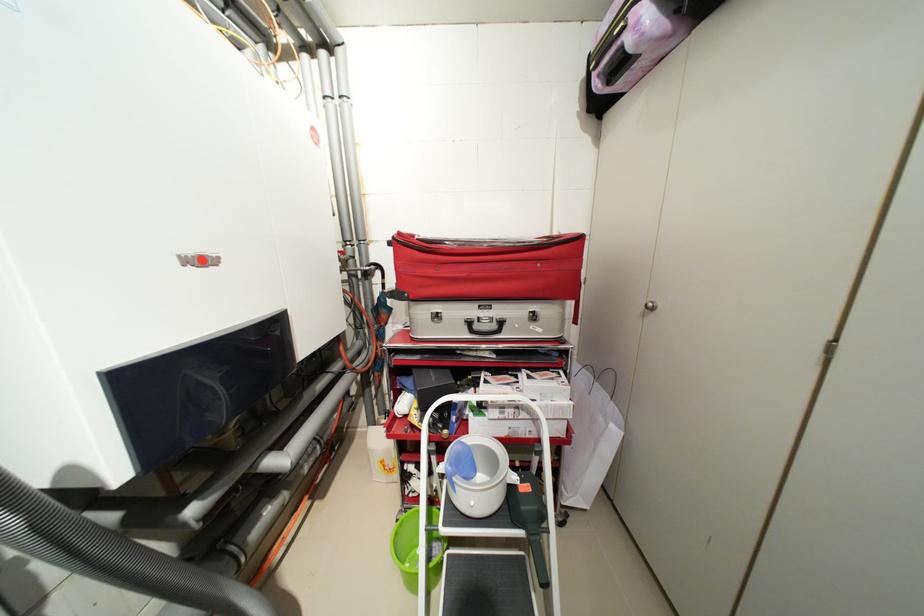
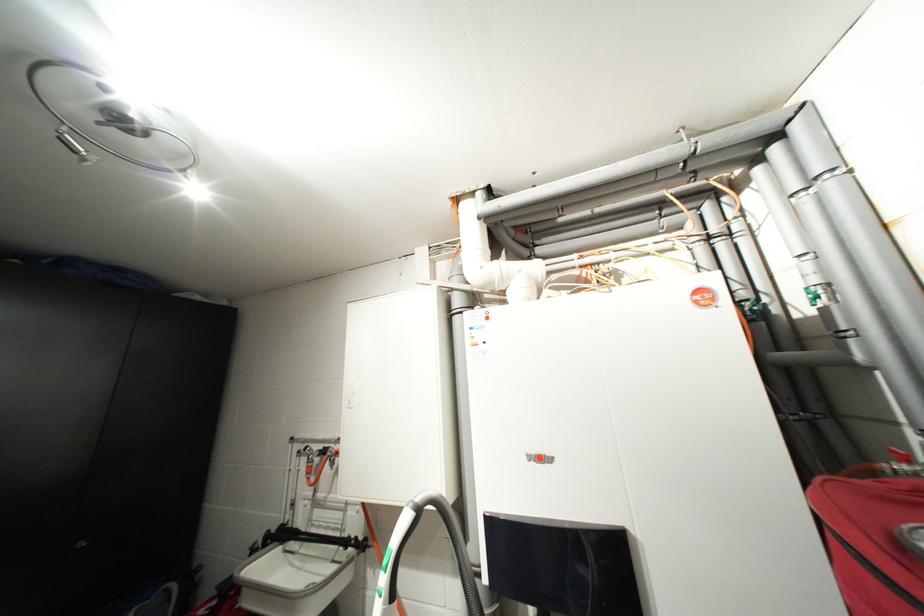
Question: The camera is either moving clockwise (left) or counter-clockwise (right) around the object. The first image is from the beginning of the video and the second image is from the end. Is the camera moving left or right when shooting the video?

Choices:
 (A) Left
 (B) Right

Answer: (B)